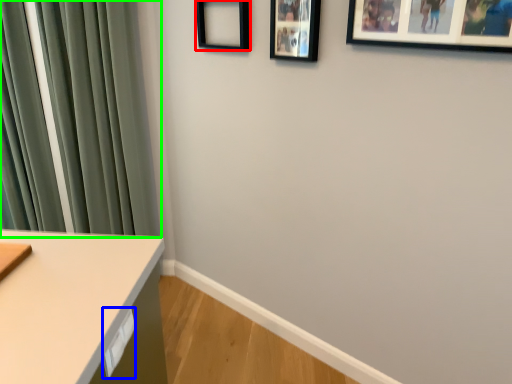
Question: Which object is the closest to the picture frame (highlighted by a red box)? Choose among these: drawer (highlighted by a blue box) or curtain (highlighted by a green box).

Choices:
 (A) drawer
 (B) curtain

Answer: (B)